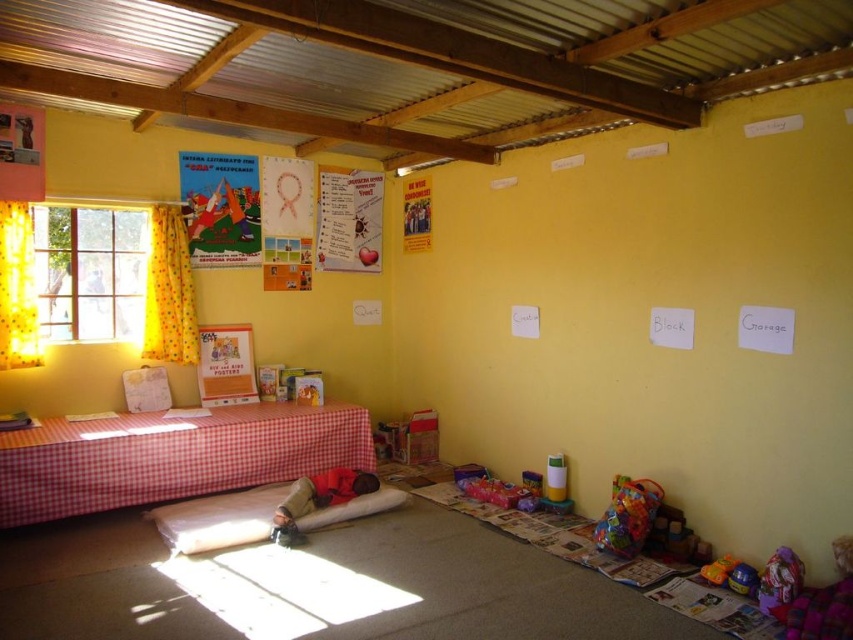
Question: In this image, where is red checkered fabric bed at lower left located relative to multicolored fabric bag at lower right?

Choices:
 (A) above
 (B) below

Answer: (A)

Question: Based on their relative distances, which object is nearer to the matte paper poster at upper left?

Choices:
 (A) yellow fabric window at left
 (B) multicolored fabric bag at lower right

Answer: (A)

Question: Is red checkered fabric bed at lower left smaller than multicolored fabric bag at lower right?

Choices:
 (A) no
 (B) yes

Answer: (A)

Question: Which of the following is the farthest from the observer?

Choices:
 (A) (136, 264)
 (B) (613, 481)

Answer: (A)

Question: Does yellow fabric window at left appear on the left side of matte cardboard poster at center?

Choices:
 (A) yes
 (B) no

Answer: (A)

Question: Which object is positioned closest to the multicolored fabric bag at lower right?

Choices:
 (A) matte paper poster at upper left
 (B) yellow fabric window at left

Answer: (A)